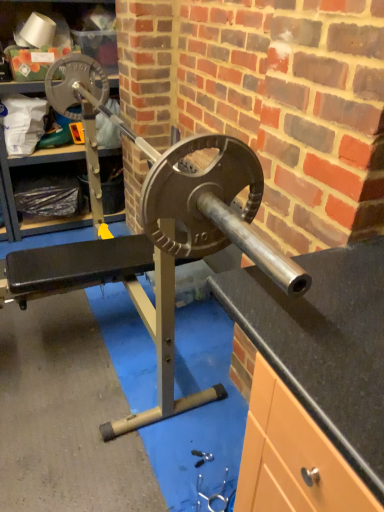
Question: Can you confirm if metallic silver tool at lower center is wider than matte black weight at left?

Choices:
 (A) yes
 (B) no

Answer: (B)

Question: Considering the relative sizes of metallic silver tool at lower center and matte black weight at left in the image provided, is metallic silver tool at lower center shorter than matte black weight at left?

Choices:
 (A) yes
 (B) no

Answer: (A)

Question: Considering the relative sizes of metallic silver tool at lower center and matte black weight at left in the image provided, is metallic silver tool at lower center thinner than matte black weight at left?

Choices:
 (A) yes
 (B) no

Answer: (A)

Question: From a real-world perspective, does metallic silver tool at lower center sit lower than matte black weight at left?

Choices:
 (A) no
 (B) yes

Answer: (B)

Question: Can you confirm if metallic silver tool at lower center is smaller than matte black weight at left?

Choices:
 (A) no
 (B) yes

Answer: (B)

Question: From a real-world perspective, is metallic silver tool at lower center over matte black weight at left?

Choices:
 (A) no
 (B) yes

Answer: (A)

Question: From a real-world perspective, is matte black weight at left positioned over metallic silver tool at lower center based on gravity?

Choices:
 (A) no
 (B) yes

Answer: (B)

Question: Does matte black weight at left have a lesser height compared to metallic silver tool at lower center?

Choices:
 (A) yes
 (B) no

Answer: (B)

Question: Can you confirm if matte black weight at left is smaller than metallic silver tool at lower center?

Choices:
 (A) yes
 (B) no

Answer: (B)

Question: Is metallic silver tool at lower center a part of matte black weight at left?

Choices:
 (A) yes
 (B) no

Answer: (B)

Question: Is matte black weight at left not near metallic silver tool at lower center?

Choices:
 (A) no
 (B) yes

Answer: (B)

Question: Is the position of matte black weight at left less distant than that of metallic silver tool at lower center?

Choices:
 (A) yes
 (B) no

Answer: (B)

Question: Is metallic silver tool at lower center bigger or smaller than matte black weight at left?

Choices:
 (A) big
 (B) small

Answer: (B)